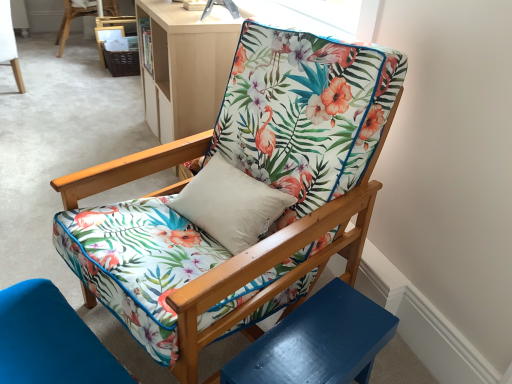
Locate an element on the screen. This screenshot has width=512, height=384. free space above glossy blue side table at lower right (from a real-world perspective) is located at coordinates click(x=320, y=333).